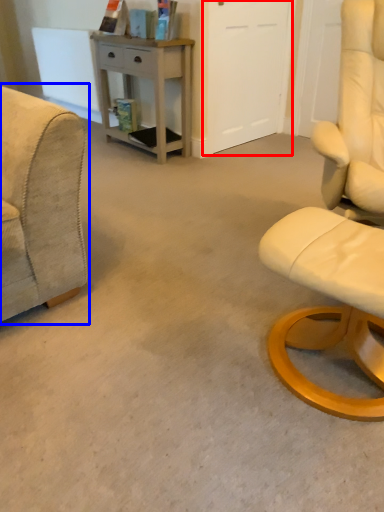
Question: Among these objects, which one is farthest to the camera, glass door (highlighted by a red box) or chair (highlighted by a blue box)?

Choices:
 (A) glass door
 (B) chair

Answer: (A)